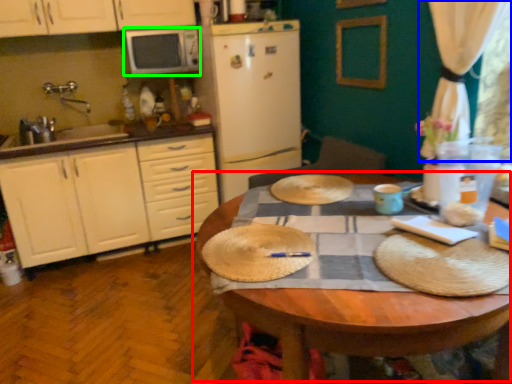
Question: Which is farther away from table (highlighted by a red box)? curtain (highlighted by a blue box) or microwave oven (highlighted by a green box)?

Choices:
 (A) curtain
 (B) microwave oven

Answer: (B)